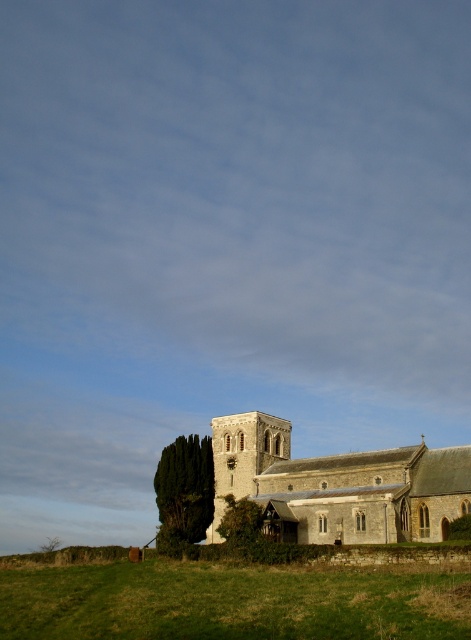
You are a landscape architect designing a walking path from the green grassy field at lower center to the stone church at center. The path must be at least 20 meters long to accommodate a gentle slope. Can the path be designed as planned?

The distance between the green grassy field at lower center and the stone church at center is 22.05 meters, which is longer than the required 20 meters. Therefore, the path can be designed as planned to accommodate the gentle slope.

You are standing in the rural scene looking at the historic stone church. There are two points marked in the image. The first point is at coordinate point(444, 632) and the second is at point(173, 515). Which point is closer to your current position?

Point(444, 632) is closer to the camera than point(173, 515).

You are planning to place a new bench in the scene. The bench requires a space wider than the green textured tree at lower left. Can the area near the stone church at center accommodate this bench?

The stone church at center is wider than the green textured tree at lower left, so the area near the stone church at center can accommodate the bench as it has sufficient width.